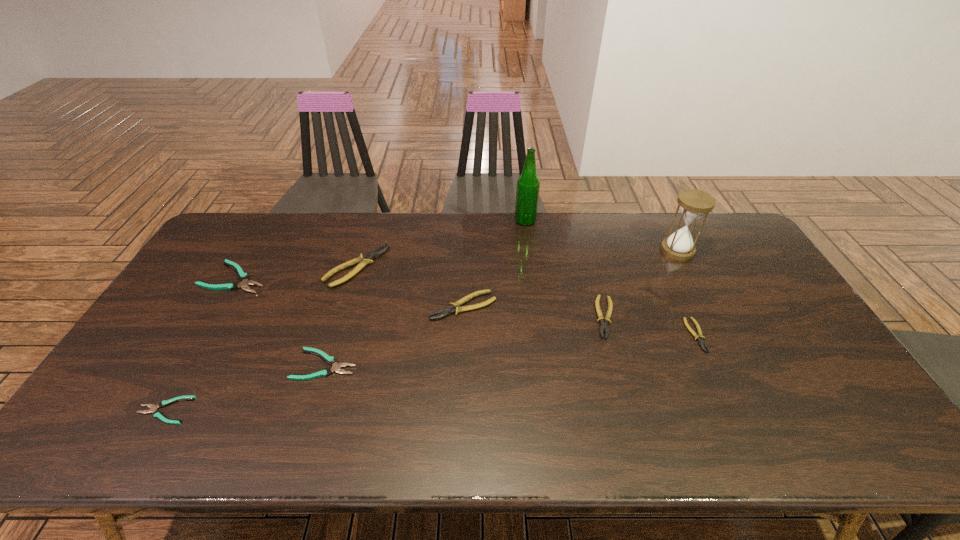
Identify the location of the fourth object from right to left. (528, 184).

Where is `the farthest object`? The height and width of the screenshot is (540, 960). the farthest object is located at coordinates (528, 184).

The width and height of the screenshot is (960, 540). Identify the location of the eighth shortest object. (694, 204).

Find the location of a particular element. white hourglass is located at coordinates (694, 204).

Locate an element on the screen. the leftmost yellow pliers is located at coordinates (363, 260).

Identify the location of the farthest yellow pliers. This screenshot has height=540, width=960. (363, 260).

Identify the location of the second biggest yellow pliers. Image resolution: width=960 pixels, height=540 pixels. (455, 307).

The image size is (960, 540). Identify the location of the sixth shortest pliers. (455, 307).

Where is `the biggest teal pliers`? This screenshot has width=960, height=540. the biggest teal pliers is located at coordinates (244, 284).

Where is `the second pliers from right to left`? the second pliers from right to left is located at coordinates (603, 325).